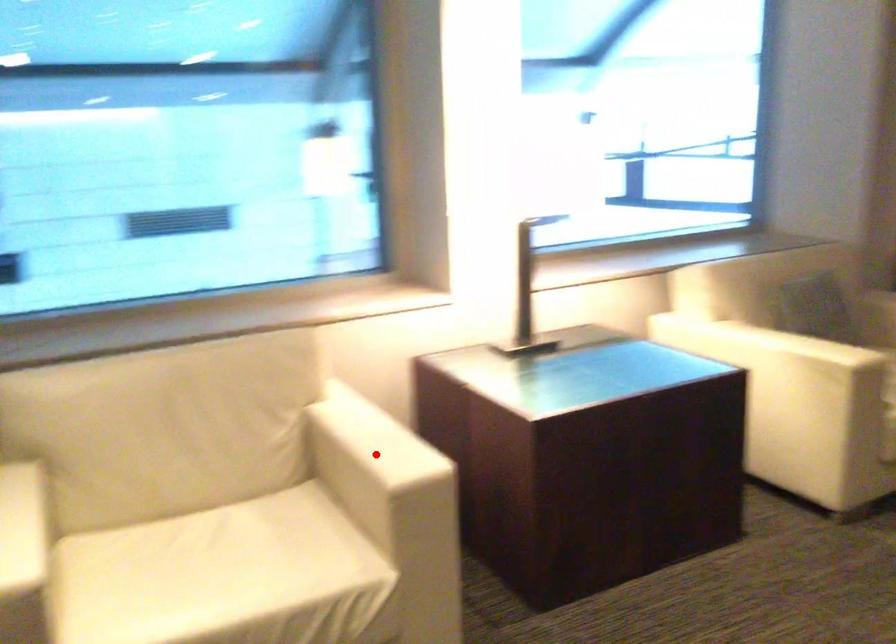
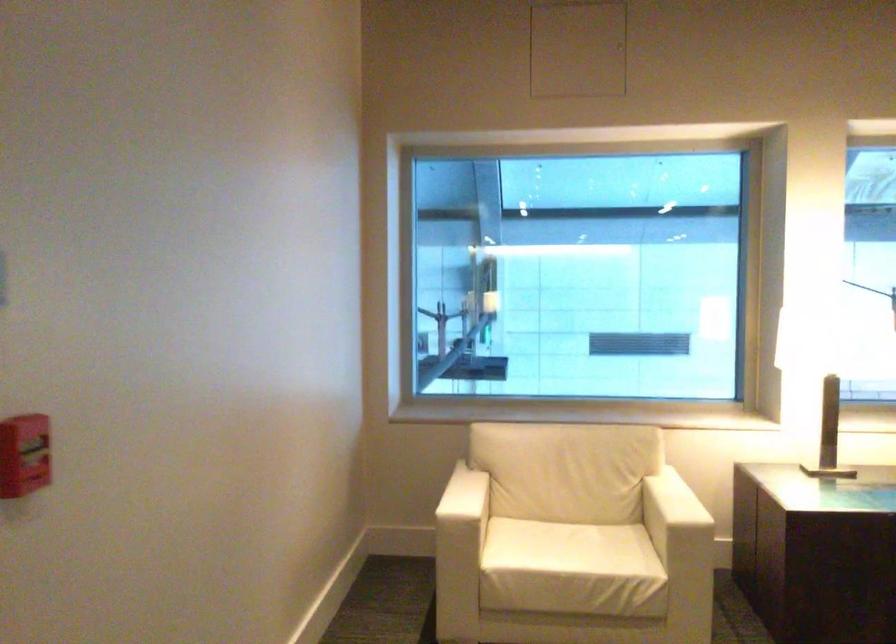
The point at the highlighted location is marked in the first image. Where is the corresponding point in the second image?

(673, 504)